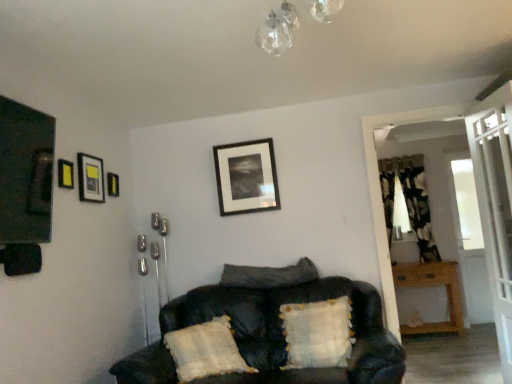
What is the approximate width of transparent glass screen door at right, arranged as the first screen door when viewed from the back?

9.40 inches.

What do you see at coordinates (112, 184) in the screenshot? I see `yellow matte picture frame at upper left, the second picture frame when ordered from back to front` at bounding box center [112, 184].

How much space does transparent glass screen door at upper right, which is the first screen door from front to back, occupy vertically?

It is 6.60 feet.

The height and width of the screenshot is (384, 512). I want to click on yellow matte picture frame at upper left, the first picture frame viewed from the front, so click(x=65, y=174).

This screenshot has width=512, height=384. What do you see at coordinates (318, 333) in the screenshot? I see `white textured pillow at center, the first pillow positioned from the right` at bounding box center [318, 333].

Measure the distance between clear glass chandelier at upper center and camera.

clear glass chandelier at upper center and camera are 1.46 meters apart.

Find the location of a particular element. The height and width of the screenshot is (384, 512). transparent glass screen door at right, arranged as the first screen door when viewed from the back is located at coordinates 380,197.

Which is nearer, [495,175] or [185,317]?

Positioned in front is point [495,175].

From a real-world perspective, which is physically below, transparent glass screen door at upper right, the 2th screen door from the back, or black leather couch at center?

black leather couch at center.

In the scene shown: Considering the relative positions of transparent glass screen door at upper right, which is the first screen door from front to back, and black leather couch at center in the image provided, is transparent glass screen door at upper right, which is the first screen door from front to back, in front of black leather couch at center?

No, transparent glass screen door at upper right, which is the first screen door from front to back, is behind black leather couch at center.

Are transparent glass screen door at upper right, which is the first screen door from front to back, and black leather couch at center located far from each other?

Yes, transparent glass screen door at upper right, which is the first screen door from front to back, is far from black leather couch at center.

From the image's perspective, which is below, matte black picture frame at upper left, marked as the third picture frame in a right-to-left arrangement, or wooden table at right?

wooden table at right.

Are matte black picture frame at upper left, the second picture frame in the left-to-right sequence, and wooden table at right located far from each other?

That's right, there is a large distance between matte black picture frame at upper left, the second picture frame in the left-to-right sequence, and wooden table at right.

How many degrees apart are the facing directions of matte black picture frame at upper left, marked as the third picture frame in a right-to-left arrangement, and wooden table at right?

They differ by 90.4 degrees in their facing directions.

From a real-world perspective, is matte black picture frame at upper left, marked as the third picture frame in a right-to-left arrangement, above or below wooden table at right?

Clearly, from a real-world perspective, matte black picture frame at upper left, marked as the third picture frame in a right-to-left arrangement, is above wooden table at right.

Is black leather couch at center positioned with its back to white textured pillow at center, the first pillow positioned from the right?

Absolutely, black leather couch at center is directed away from white textured pillow at center, the first pillow positioned from the right.

How distant is black leather couch at center from white textured pillow at center, which ranks as the 3th pillow in left-to-right order?

black leather couch at center and white textured pillow at center, which ranks as the 3th pillow in left-to-right order, are 24.21 centimeters apart.

Looking at the image, does black leather couch at center seem bigger or smaller compared to white textured pillow at center, which ranks as the 3th pillow in left-to-right order?

Considering their sizes, black leather couch at center takes up more space than white textured pillow at center, which ranks as the 3th pillow in left-to-right order.

Does wooden table at right lie in front of matte black picture frame at upper left, which is the 2th picture frame from front to back?

No, it is not.

Can we say wooden table at right lies outside matte black picture frame at upper left, which is the 2th picture frame from front to back?

Yes, wooden table at right is outside of matte black picture frame at upper left, which is the 2th picture frame from front to back.

This screenshot has height=384, width=512. Find the location of `the 4th picture frame located above the wooden table at right (from a real-world perspective)`. the 4th picture frame located above the wooden table at right (from a real-world perspective) is located at coordinates (90, 178).

Is wooden table at right to the left of matte black picture frame at upper left, marked as the third picture frame in a right-to-left arrangement, from the viewer's perspective?

No, wooden table at right is not to the left of matte black picture frame at upper left, marked as the third picture frame in a right-to-left arrangement.

From the image's perspective, which object appears higher, transparent glass screen door at upper right, the 2th screen door from the back, or white textured pillow at center, the first pillow positioned from the right?

From the image's view, transparent glass screen door at upper right, the 2th screen door from the back, is above.

Considering the sizes of objects transparent glass screen door at upper right, which is the first screen door from front to back, and white textured pillow at center, which ranks as the 3th pillow in left-to-right order, in the image provided, who is thinner, transparent glass screen door at upper right, which is the first screen door from front to back, or white textured pillow at center, which ranks as the 3th pillow in left-to-right order,?

transparent glass screen door at upper right, which is the first screen door from front to back.

Considering the sizes of objects transparent glass screen door at upper right, which is the first screen door from front to back, and white textured pillow at center, the first pillow positioned from the right, in the image provided, who is taller, transparent glass screen door at upper right, which is the first screen door from front to back, or white textured pillow at center, the first pillow positioned from the right,?

With more height is transparent glass screen door at upper right, which is the first screen door from front to back.

From the picture: Could you tell me if black leather couch at center is turned towards floral fabric curtain at right?

No, black leather couch at center is not oriented towards floral fabric curtain at right.

Between black leather couch at center and floral fabric curtain at right, which one has more height?

floral fabric curtain at right is taller.

From a real-world perspective, which is physically below, black leather couch at center or floral fabric curtain at right?

black leather couch at center, from a real-world perspective.

Is matte black picture frame at upper left, the second picture frame in the left-to-right sequence, in front of or behind transparent glass screen door at right, acting as the second screen door starting from the front, in the image?

In the image, matte black picture frame at upper left, the second picture frame in the left-to-right sequence, appears in front of transparent glass screen door at right, acting as the second screen door starting from the front.

Based on the photo, between matte black picture frame at upper left, the second picture frame in the left-to-right sequence, and transparent glass screen door at right, acting as the second screen door starting from the front, which one has larger size?

With larger size is transparent glass screen door at right, acting as the second screen door starting from the front.

From the image's perspective, relative to transparent glass screen door at right, acting as the second screen door starting from the front, is matte black picture frame at upper left, marked as the third picture frame in a right-to-left arrangement, above or below?

matte black picture frame at upper left, marked as the third picture frame in a right-to-left arrangement, is above transparent glass screen door at right, acting as the second screen door starting from the front.

Identify the location of studio couch below the transparent glass screen door at upper right, the 2th screen door from the back (from a real-world perspective). The width and height of the screenshot is (512, 384). (273, 332).

Find the location of `the 4th picture frame located above the wooden table at right (from a real-world perspective)`. the 4th picture frame located above the wooden table at right (from a real-world perspective) is located at coordinates (90, 178).

Based on their spatial positions, is clear glass chandelier at upper center or black leather couch at center further from yellow matte picture frame at upper left, which is the second picture frame in right-to-left order?

Based on the image, clear glass chandelier at upper center appears to be further to yellow matte picture frame at upper left, which is the second picture frame in right-to-left order.

Considering their positions, is black matte picture frame at upper center, which appears as the 4th picture frame when viewed from the left, positioned further to velvety dark gray pillow at center, which is counted as the second pillow, starting from the right, than yellow matte picture frame at upper left, the second picture frame when ordered from back to front?

Among the two, yellow matte picture frame at upper left, the second picture frame when ordered from back to front, is located further to velvety dark gray pillow at center, which is counted as the second pillow, starting from the right.

Looking at the image, which one is located further to velvety dark gray pillow at center, arranged as the second pillow when viewed from the left, yellow matte picture frame at upper left, the first picture frame viewed from the front, or transparent glass screen door at right, acting as the second screen door starting from the front?

yellow matte picture frame at upper left, the first picture frame viewed from the front, is positioned further to the anchor velvety dark gray pillow at center, arranged as the second pillow when viewed from the left.

Which object lies further to the anchor point white textured pillow at center, which ranks as the 3th pillow in left-to-right order, floral fabric curtain at right or velvety dark gray pillow at center, arranged as the second pillow when viewed from the left?

The object further to white textured pillow at center, which ranks as the 3th pillow in left-to-right order, is floral fabric curtain at right.

From the image, which object appears to be farther from clear glass chandelier at upper center, transparent glass screen door at upper right, which is the first screen door from front to back, or wooden table at right?

Among the two, wooden table at right is located further to clear glass chandelier at upper center.

When comparing their distances from yellow matte picture frame at upper left, arranged as the 1th picture frame when viewed from the left, does floral fabric curtain at right or matte black picture frame at upper left, marked as the third picture frame in a back-to-front arrangement, seem closer?

Based on the image, matte black picture frame at upper left, marked as the third picture frame in a back-to-front arrangement, appears to be nearer to yellow matte picture frame at upper left, arranged as the 1th picture frame when viewed from the left.

Based on their spatial positions, is clear glass chandelier at upper center or black leather couch at center closer to black matte picture frame at upper center, which is the 4th picture frame in front-to-back order?

black leather couch at center is closer to black matte picture frame at upper center, which is the 4th picture frame in front-to-back order.

Looking at the image, which one is located closer to black matte picture frame at upper center, the first picture frame when ordered from right to left, clear glass chandelier at upper center or transparent glass screen door at right, arranged as the first screen door when viewed from the back?

Based on the image, transparent glass screen door at right, arranged as the first screen door when viewed from the back, appears to be nearer to black matte picture frame at upper center, the first picture frame when ordered from right to left.

At what (x,y) coordinates should I click in order to perform the action: click on curtain between yellow matte picture frame at upper left, acting as the 3th picture frame starting from the front, and wooden table at right from left to right. Please return your answer as a coordinate pair (x, y). Looking at the image, I should click on (409, 201).

Identify the location of table between white textured pillow at center, the first pillow positioned from the right, and floral fabric curtain at right from front to back. This screenshot has width=512, height=384. click(x=432, y=286).

Where is `studio couch that lies between yellow matte picture frame at upper left, the fourth picture frame in the right-to-left sequence, and white textured pillow at lower center, positioned as the first pillow in left-to-right order, from top to bottom`? The width and height of the screenshot is (512, 384). studio couch that lies between yellow matte picture frame at upper left, the fourth picture frame in the right-to-left sequence, and white textured pillow at lower center, positioned as the first pillow in left-to-right order, from top to bottom is located at coordinates (273, 332).

Image resolution: width=512 pixels, height=384 pixels. Find the location of `studio couch between yellow matte picture frame at upper left, the first picture frame viewed from the front, and floral fabric curtain at right from left to right`. studio couch between yellow matte picture frame at upper left, the first picture frame viewed from the front, and floral fabric curtain at right from left to right is located at coordinates coord(273,332).